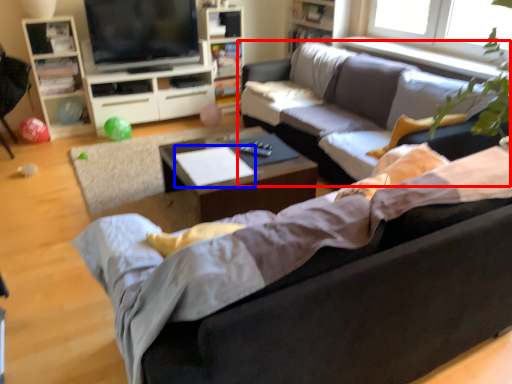
Question: Which object appears closest to the camera in this image, studio couch (highlighted by a red box) or sheet (highlighted by a blue box)?

Choices:
 (A) studio couch
 (B) sheet

Answer: (A)